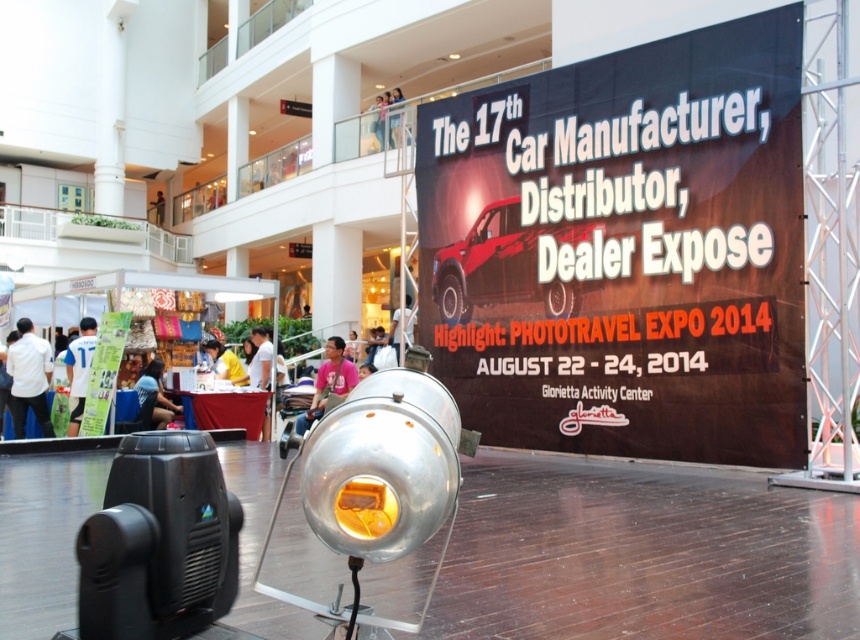
You are a photographer at the event and need to adjust your camera settings to capture both the white shirt at lower left and the blue fabric shirt at center. Which shirt should you focus on first to ensure proper exposure, considering their positions?

The white shirt at lower left should be focused on first because it is located above the blue fabric shirt at center, so it will be in the foreground and require proper exposure first.

You are a photographer setting up equipment in the event space. You need to position a camera on a tripod so that it can capture both the matte black banner at upper right and the light blue jeans at upper center in the frame. Considering their heights, which object will appear larger in the photo?

The matte black banner at upper right will appear larger in the photo because it has a greater height compared to the light blue jeans at upper center.